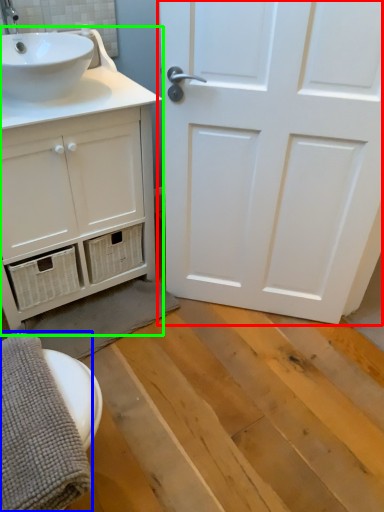
Question: Which object is the closest to the door (highlighted by a red box)? Choose among these: bath towel (highlighted by a blue box) or bathroom cabinet (highlighted by a green box).

Choices:
 (A) bath towel
 (B) bathroom cabinet

Answer: (B)